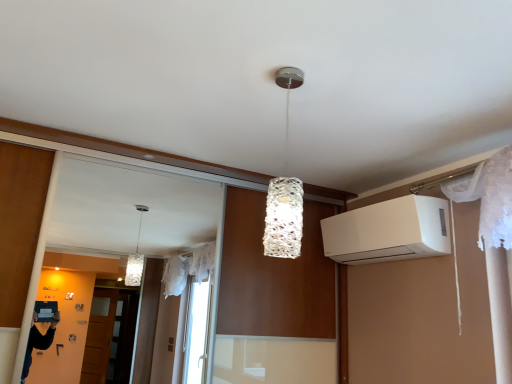
Identify the location of white matte air conditioner at upper right. (389, 231).

In order to face white matte air conditioner at upper right, should I rotate leftwards or rightwards?

To face it directly, rotate right by 16.432 degrees.

What do you see at coordinates (389, 231) in the screenshot? I see `white matte air conditioner at upper right` at bounding box center [389, 231].

What do you see at coordinates (284, 218) in the screenshot?
I see `white textured lamp at center` at bounding box center [284, 218].

At what (x,y) coordinates should I click in order to perform the action: click on white textured lamp at center. Please return your answer as a coordinate pair (x, y). Looking at the image, I should click on (284, 218).

At what (x,y) coordinates should I click in order to perform the action: click on white matte air conditioner at upper right. Please return your answer as a coordinate pair (x, y). The image size is (512, 384). Looking at the image, I should click on (389, 231).

In the image, is white textured lamp at center on the left side or the right side of white matte air conditioner at upper right?

white textured lamp at center is positioned on white matte air conditioner at upper right's left side.

Does white textured lamp at center come behind white matte air conditioner at upper right?

No, the depth of white textured lamp at center is less than that of white matte air conditioner at upper right.

Considering the positions of points (281, 230) and (418, 217), is point (281, 230) closer to camera compared to point (418, 217)?

Yes, point (281, 230) is in front of point (418, 217).

From the image's perspective, would you say white textured lamp at center is shown under white matte air conditioner at upper right?

Incorrect, from the image's perspective, white textured lamp at center is higher than white matte air conditioner at upper right.

From a real-world perspective, is white textured lamp at center physically located above or below white matte air conditioner at upper right?

From a real-world perspective, white textured lamp at center is physically above white matte air conditioner at upper right.

Looking at this image, is white textured lamp at center wider or thinner than white matte air conditioner at upper right?

In the image, white textured lamp at center appears to be more narrow than white matte air conditioner at upper right.

Is white textured lamp at center taller than white matte air conditioner at upper right?

Indeed, white textured lamp at center has a greater height compared to white matte air conditioner at upper right.

Between white textured lamp at center and white matte air conditioner at upper right, which one has larger size?

white matte air conditioner at upper right.

Is white matte air conditioner at upper right a part of white textured lamp at center?

No, white matte air conditioner at upper right is not inside white textured lamp at center.

Is white textured lamp at center directly adjacent to white matte air conditioner at upper right?

No, white textured lamp at center is not next to white matte air conditioner at upper right.

Is white textured lamp at center facing away from white matte air conditioner at upper right?

white textured lamp at center does not have its back to white matte air conditioner at upper right.

What's the angular difference between white textured lamp at center and white matte air conditioner at upper right's facing directions?

There is a 2.31-degree angle between the facing directions of white textured lamp at center and white matte air conditioner at upper right.

In the scene shown: How far apart are white textured lamp at center and white matte air conditioner at upper right?

white textured lamp at center is 38.68 inches from white matte air conditioner at upper right.

You are a GUI agent. You are given a task and a screenshot of the screen. Output one action in this format:
    pyautogui.click(x=<x>, y=<y>)
    Task: Click on the lamp above the white matte air conditioner at upper right (from the image's perspective)
    
    Given the screenshot: What is the action you would take?
    pyautogui.click(x=284, y=218)

Is white matte air conditioner at upper right at the right side of white textured lamp at center?

Correct, you'll find white matte air conditioner at upper right to the right of white textured lamp at center.

Which is behind, white matte air conditioner at upper right or white textured lamp at center?

white matte air conditioner at upper right is further away from the camera.

Which is closer to the camera, (x=328, y=221) or (x=280, y=231)?

Point (x=328, y=221) is positioned farther from the camera compared to point (x=280, y=231).

From the image's perspective, which one is positioned lower, white matte air conditioner at upper right or white textured lamp at center?

white matte air conditioner at upper right.

Looking at this image, from a real-world perspective, is white matte air conditioner at upper right below white textured lamp at center?

Yes, from a real-world perspective, white matte air conditioner at upper right is below white textured lamp at center.

Between white matte air conditioner at upper right and white textured lamp at center, which one has larger width?

Wider between the two is white matte air conditioner at upper right.

From their relative heights in the image, would you say white matte air conditioner at upper right is taller or shorter than white textured lamp at center?

Clearly, white matte air conditioner at upper right is shorter compared to white textured lamp at center.

Looking at the image, does white matte air conditioner at upper right seem bigger or smaller compared to white textured lamp at center?

In the image, white matte air conditioner at upper right appears to be larger than white textured lamp at center.

Do you think white matte air conditioner at upper right is within white textured lamp at center, or outside of it?

white matte air conditioner at upper right is not enclosed by white textured lamp at center.

Is the surface of white matte air conditioner at upper right in direct contact with white textured lamp at center?

No.

Is white matte air conditioner at upper right looking in the opposite direction of white textured lamp at center?

white matte air conditioner at upper right does not have its back to white textured lamp at center.

What's the angular difference between white matte air conditioner at upper right and white textured lamp at center's facing directions?

The angular difference between white matte air conditioner at upper right and white textured lamp at center is 2.31 degrees.

In order to click on lamp that appears above the white matte air conditioner at upper right (from the image's perspective) in this screenshot , I will do `click(284, 218)`.

Where is `lamp lying on the left of white matte air conditioner at upper right`? The width and height of the screenshot is (512, 384). lamp lying on the left of white matte air conditioner at upper right is located at coordinates (284, 218).

Image resolution: width=512 pixels, height=384 pixels. I want to click on air conditioning directly beneath the white textured lamp at center (from a real-world perspective), so click(x=389, y=231).